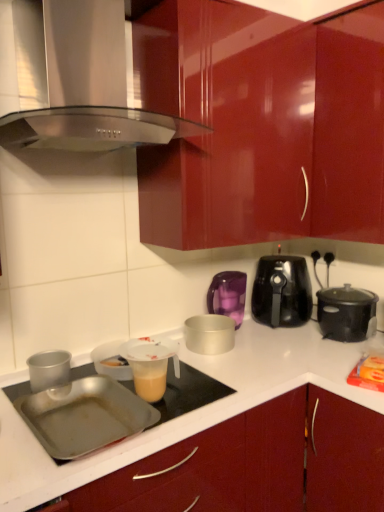
Question: From a real-world perspective, is black plastic air fryer at center right, which is the 2th kitchen appliance from right to left, above or below black plastic slow cooker at right, placed as the first kitchen appliance when sorted from right to left?

Choices:
 (A) below
 (B) above

Answer: (B)

Question: From the image's perspective, is black plastic air fryer at center right, which is the 2th kitchen appliance from right to left, located above or below black plastic slow cooker at right, placed as the first kitchen appliance when sorted from right to left?

Choices:
 (A) above
 (B) below

Answer: (A)

Question: Which is nearer to the stainless steel range hood at upper center?

Choices:
 (A) glossy wood cabinet at center
 (B) translucent plastic measuring cup at center
 (C) black plastic slow cooker at right, placed as the first kitchen appliance when sorted from right to left
 (D) matte silver container at center, which ranks as the third kitchen appliance in right-to-left order
 (E) silver metallic pot at center, the 4th kitchen appliance positioned from the right

Answer: (B)

Question: Considering the real-world distances, which object is farthest from the glossy wood cabinet at center?

Choices:
 (A) black plastic air fryer at center right, which is the 2th kitchen appliance from right to left
 (B) orange plastic bag at lower right
 (C) metallic silver pan at lower left
 (D) translucent plastic measuring cup at center
 (E) matte silver container at center, which ranks as the third kitchen appliance in right-to-left order

Answer: (E)